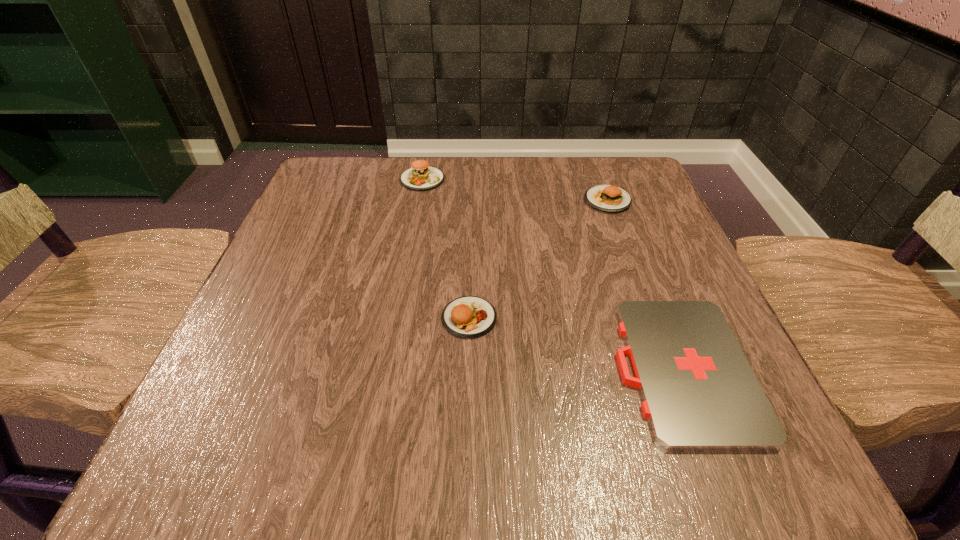
Where is `the leftmost object`? The image size is (960, 540). the leftmost object is located at coordinates (421, 176).

At what (x,y) coordinates should I click in order to perform the action: click on the rightmost patty (food). Please return your answer as a coordinate pair (x, y). Looking at the image, I should click on (606, 198).

This screenshot has height=540, width=960. I want to click on the third object from right to left, so click(468, 317).

Find the location of `the shortest patty (food)`. the shortest patty (food) is located at coordinates (468, 317).

The image size is (960, 540). Find the location of `the first-aid kit`. the first-aid kit is located at coordinates (699, 392).

Locate an element on the screen. This screenshot has width=960, height=540. free space located 0.280m on the front of the leftmost object is located at coordinates (405, 279).

In order to click on vacant area situated on the front of the rightmost patty (food) in this screenshot , I will do `click(622, 242)`.

Locate an element on the screen. The width and height of the screenshot is (960, 540). vacant space located on the back of the shortest patty (food) is located at coordinates (470, 252).

Locate an element on the screen. Image resolution: width=960 pixels, height=540 pixels. free space located 0.090m on handle side the shortest object is located at coordinates (558, 369).

Image resolution: width=960 pixels, height=540 pixels. Identify the location of free spot located on handle side the shortest object. pos(448,369).